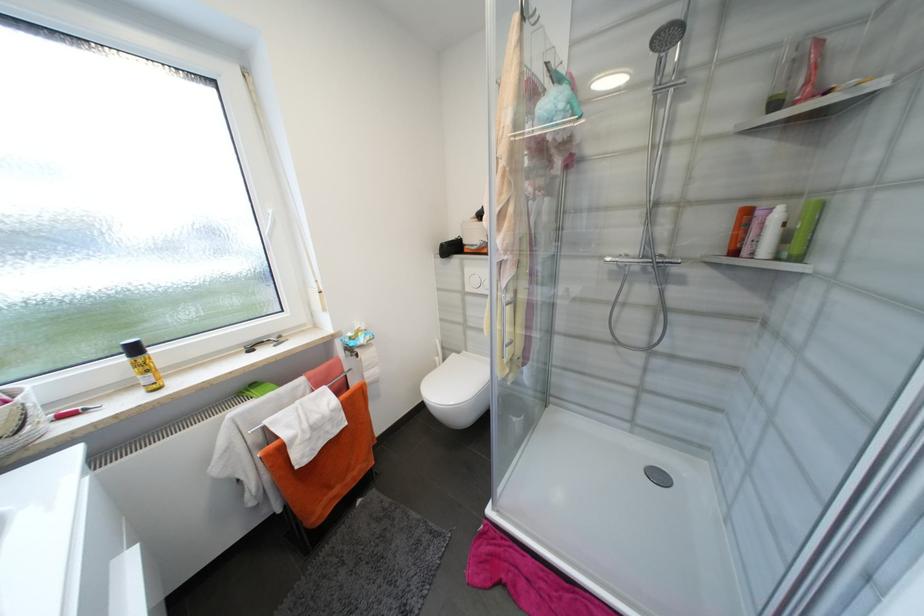
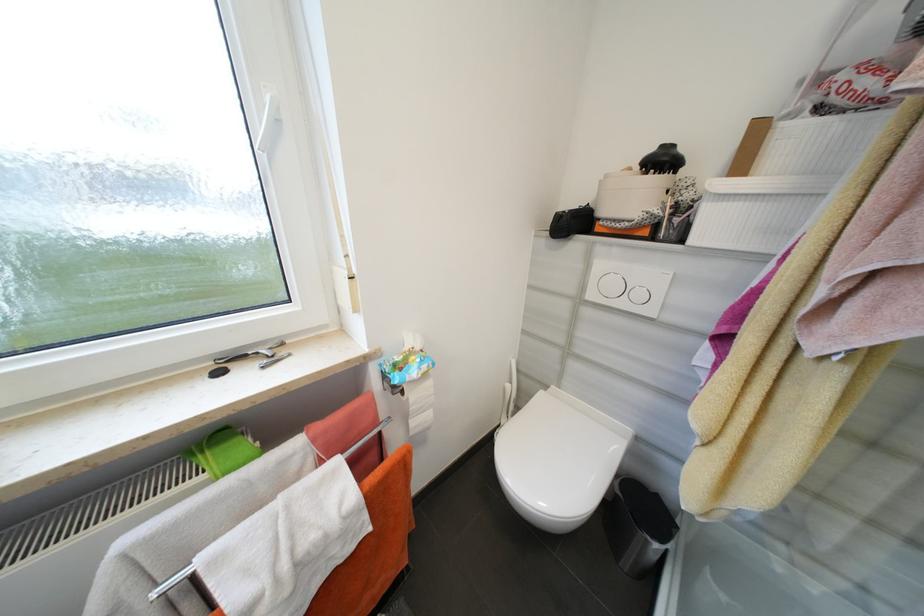
Locate, in the second image, the point that corresponds to (x=447, y=246) in the first image.

(565, 217)